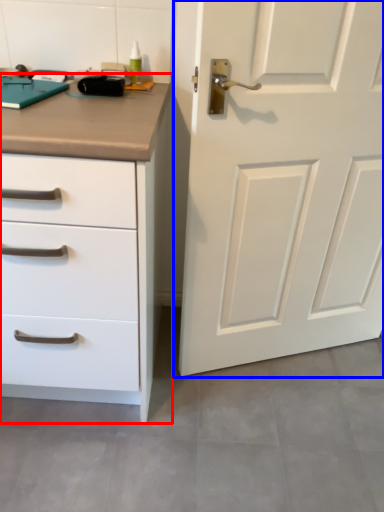
Question: Which object appears closest to the camera in this image, chest of drawers (highlighted by a red box) or door (highlighted by a blue box)?

Choices:
 (A) chest of drawers
 (B) door

Answer: (A)